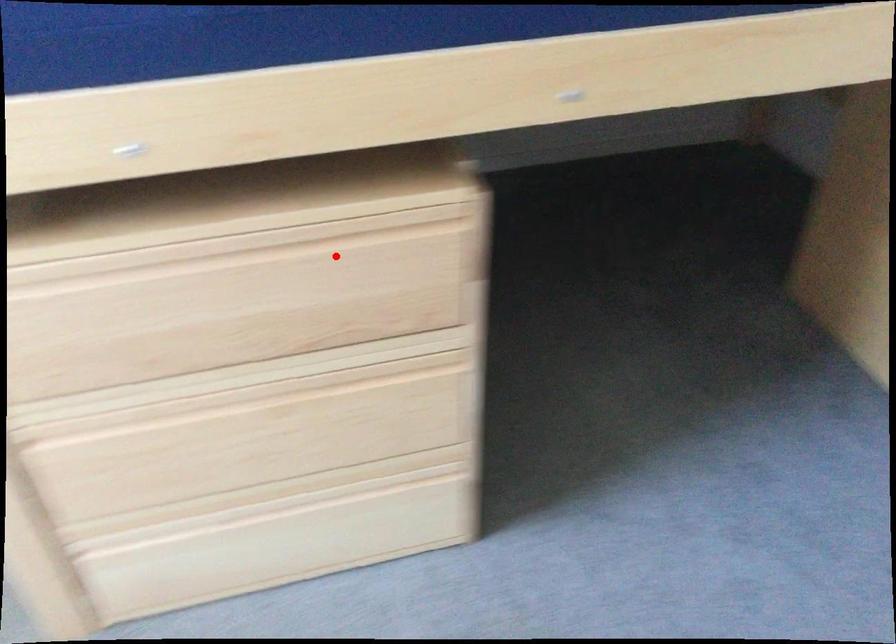
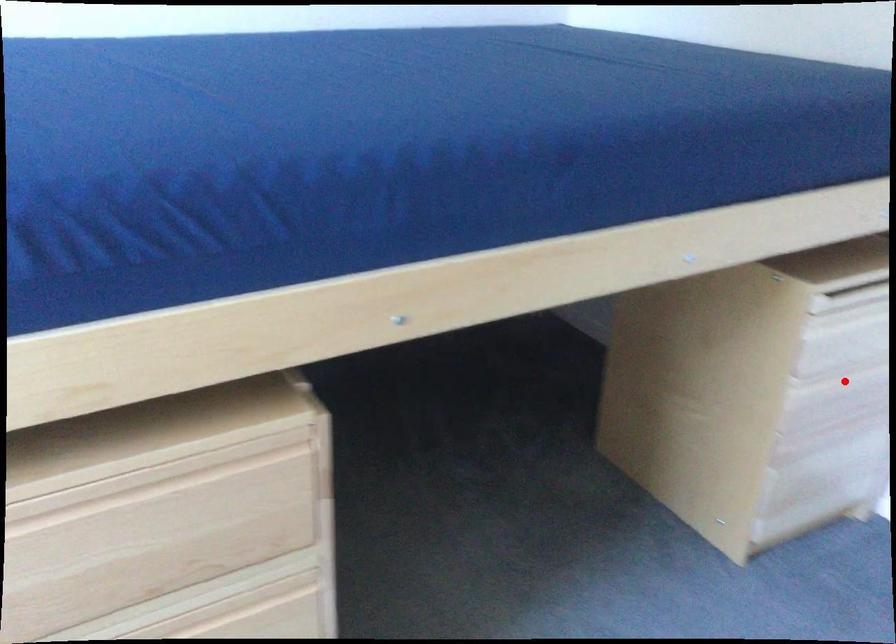
I am providing you with two images of the same scene from different viewpoints. A red point is marked on the first image and another point is marked on the second image. Are the points marked in image1 and image2 representing the same 3D position?

No